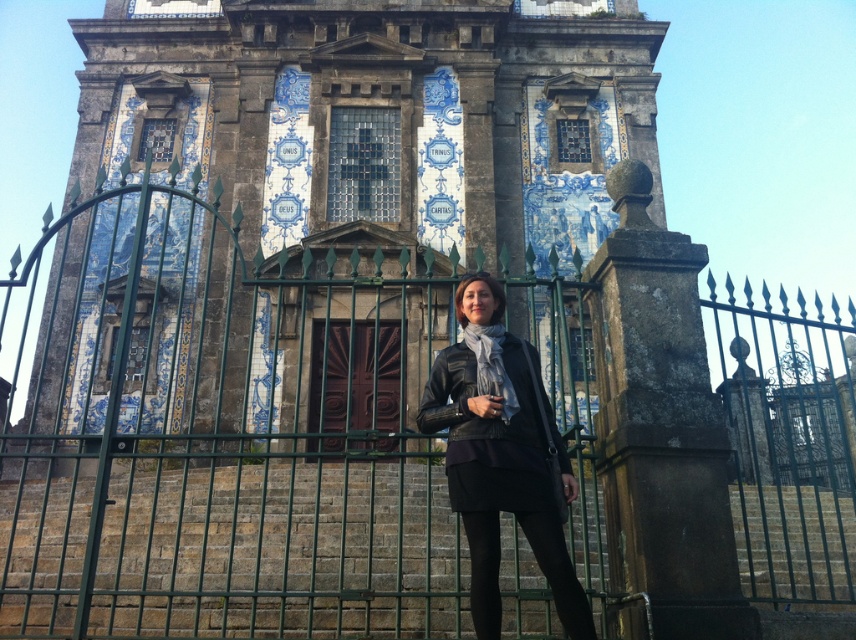
You are a tour guide leading a group to the historic building. You want to ensure that your group can see the blue glazed tiles at center clearly from where they are standing. The recommended viewing distance for such tiles is between 100 to 120 feet. Is the current distance suitable?

The blue glazed tiles at center is 105.03 feet away from camera, which falls within the recommended viewing distance of 100 to 120 feet. Therefore, the current distance is suitable for clear viewing.

You are a photographer wanting to capture both the blue glazed tiles at center and the black leather jacket at center in the same frame. Which object should you focus on first to ensure both are in the frame without moving the camera?

Focus on the blue glazed tiles at center first since its width is greater than the black leather jacket at center, ensuring both fit in the frame by centering the wider object.

You are a tourist standing in front of the historic building and notice both the blue glazed tiles at center and the black leather jacket at center. Which object is located to the left when facing the building?

The blue glazed tiles at center is positioned on the left side of black leather jacket at center, so it is located to the left when facing the building.